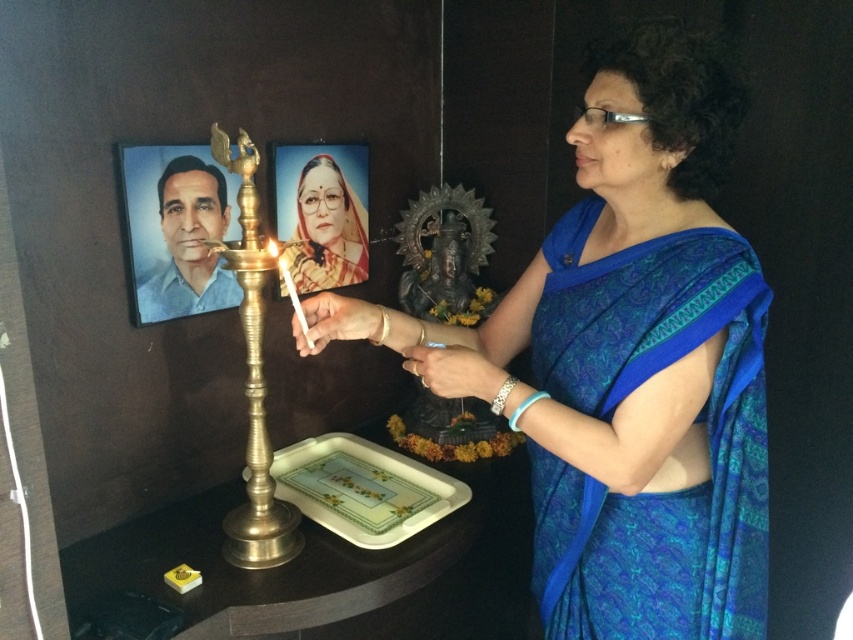
Question: Is the position of green glossy tray at center more distant than that of matte yellow portrait at upper center?

Choices:
 (A) no
 (B) yes

Answer: (A)

Question: Where is green glossy tray at center located in relation to matte black portrait at left in the image?

Choices:
 (A) below
 (B) above

Answer: (A)

Question: Estimate the real-world distances between objects in this image. Which object is closer to the matte yellow portrait at upper center?

Choices:
 (A) blue silk saree at center
 (B) gold brass candle holder at center

Answer: (B)

Question: Which point is closer to the camera?

Choices:
 (A) (175, 305)
 (B) (317, 188)
 (C) (355, 460)

Answer: (A)

Question: Which point is closer to the camera?

Choices:
 (A) (300, 218)
 (B) (326, 444)
 (C) (155, 284)

Answer: (C)

Question: Considering the relative positions of blue silk saree at center and gold brass candle holder at center in the image provided, where is blue silk saree at center located with respect to gold brass candle holder at center?

Choices:
 (A) left
 (B) right

Answer: (B)